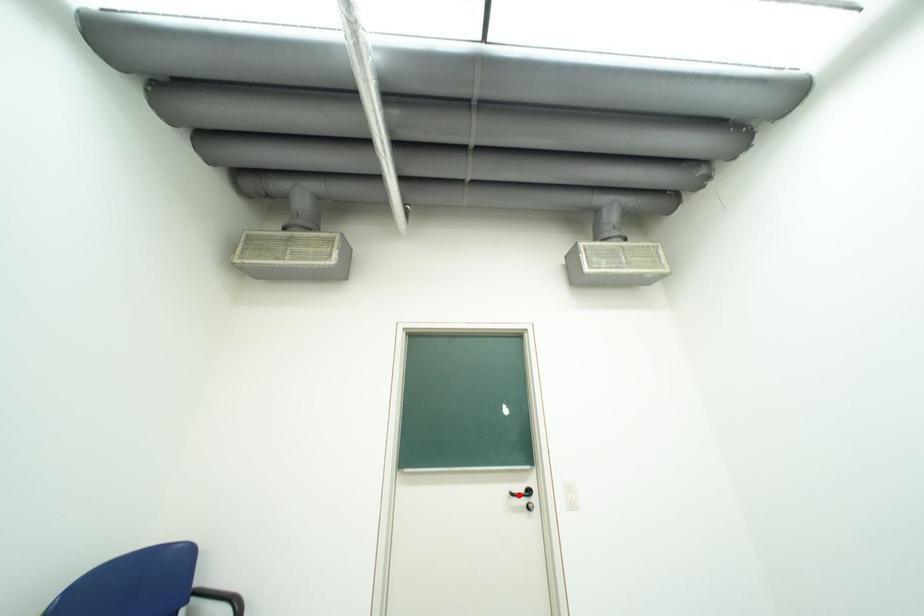
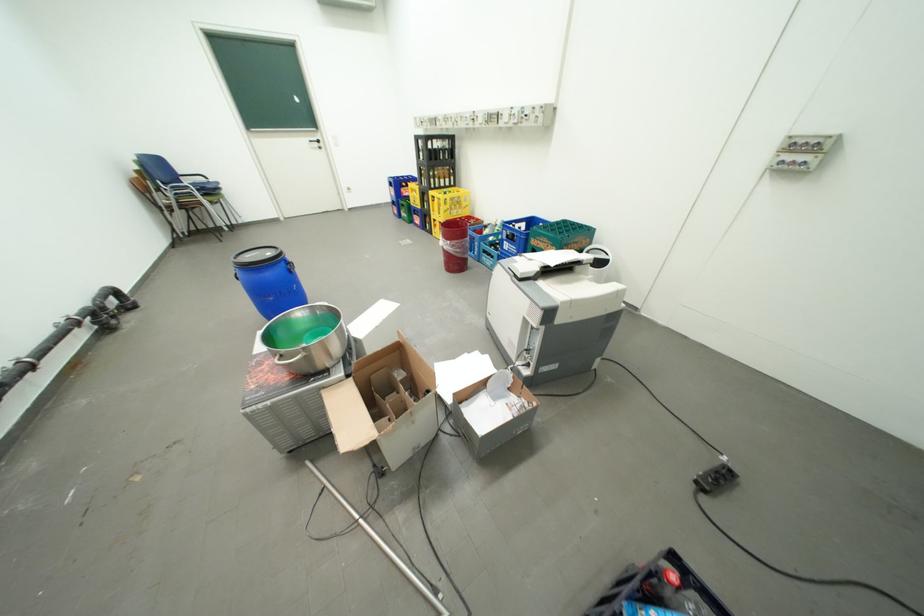
Question: I am providing you with two images of the same scene from different viewpoints. A red point is shown in image1. For the corresponding object point in image2, is it positioned nearer or farther from the camera?

Choices:
 (A) Nearer
 (B) Farther

Answer: (A)